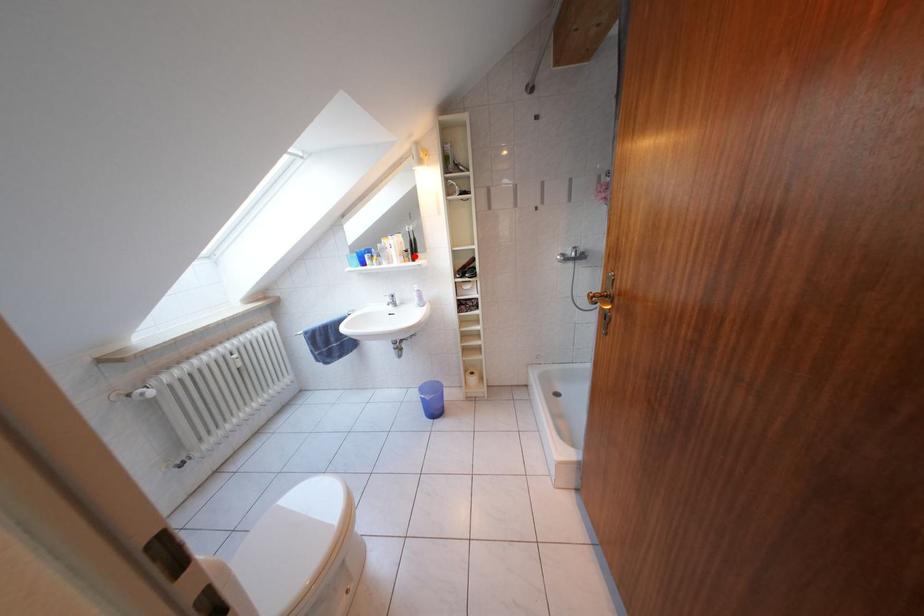
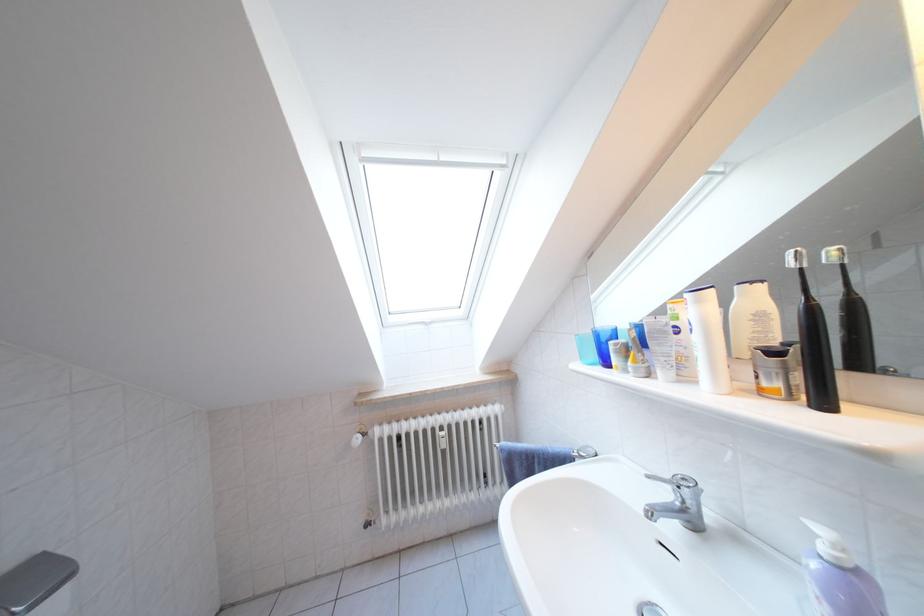
Where in the second image is the point corresponding to the highlighted location from the first image?

(783, 359)